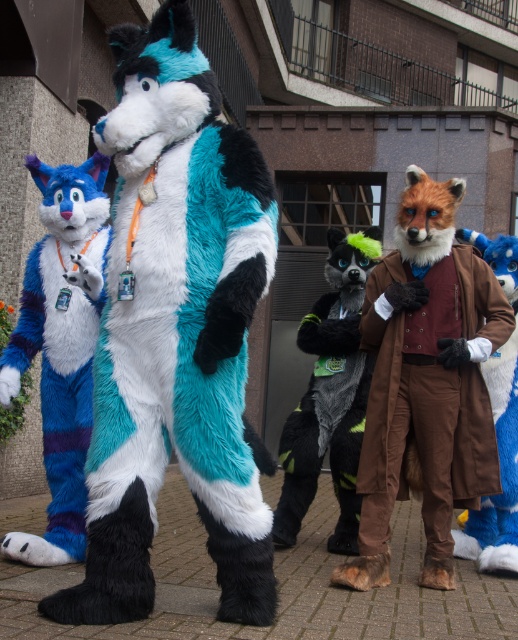
You are a photographer holding a camera and want to take a picture of the teal fur coat at center. If you need to be exactly 8 feet away to get a clear shot, will you be able to take the photo without moving?

Yes, because the teal fur coat at center and camera are 8.32 feet apart, which is slightly more than the required 8 feet distance. You can take the photo without moving.

You are a photographer setting up a tripod to capture a group photo of the teal fur coat at center and the fluffy blue and white fur at left. The tripod can only accommodate a total width of 1.5 meters. Based on the scene, can you determine if both characters can fit within the frame without overlapping?

The teal fur coat at center might be wider than the fluffy blue and white fur at left, so the combined width of both could exceed the tripod frame limit. It is uncertain if they will fit without overlapping.

You are organizing a photo shoot for a magazine and need to arrange the teal fur coat at center and the fluffy blue and white fur at left in a way that highlights their sizes. Since you want the larger one to stand out more, which position should each be placed in?

The teal fur coat at center is larger in size than the fluffy blue and white fur at left, so to highlight its size, the teal fur coat at center should be placed in the foreground or a central position, while the fluffy blue and white fur at left can be positioned slightly behind or to the side.